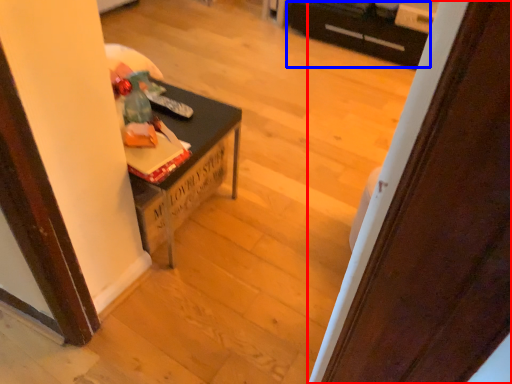
Question: Which object is further to the camera taking this photo, door (highlighted by a red box) or drawer (highlighted by a blue box)?

Choices:
 (A) door
 (B) drawer

Answer: (B)